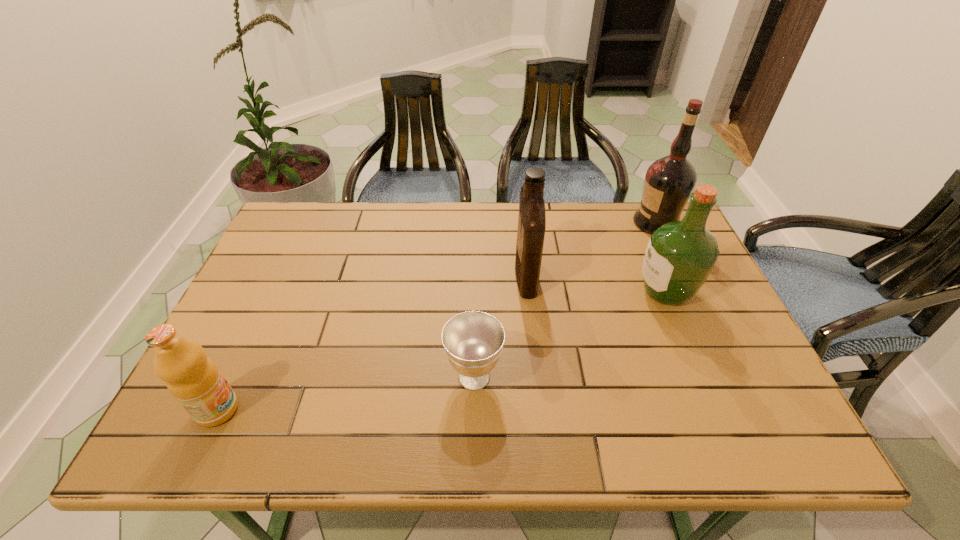
Locate which liquor ranks second in proximity to the leftmost liquor. Please provide its 2D coordinates. Your answer should be formatted as a tuple, i.e. [(x, y)], where the tuple contains the x and y coordinates of a point satisfying the conditions above.

[(669, 181)]